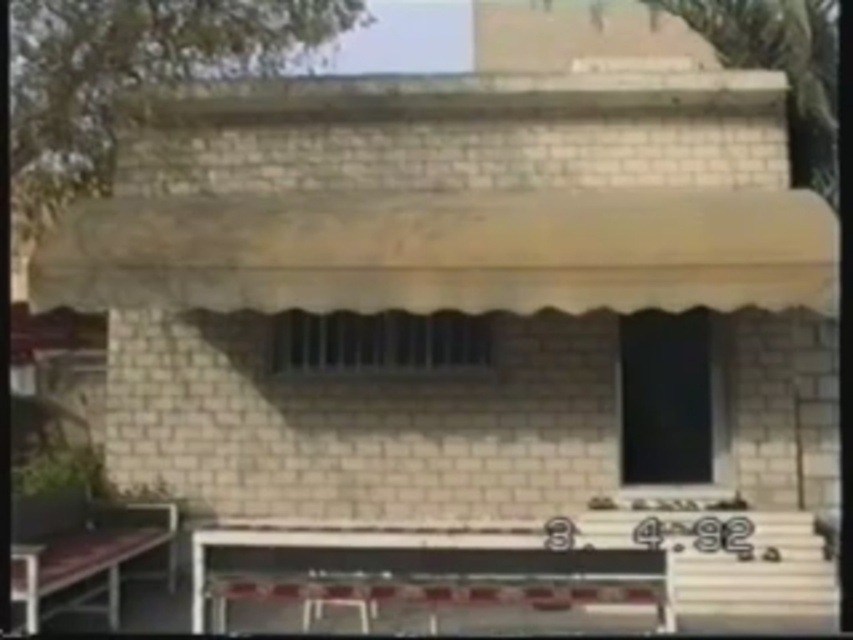
In the scene shown: Measure the distance between point [595,580] and camera.

Point [595,580] and camera are 22.18 feet apart from each other.

Is point (252, 554) positioned before point (83, 525)?

Yes, point (252, 554) is closer to viewer.

Who is more distant from viewer, (379, 577) or (38, 532)?

The point (38, 532) is more distant.

The width and height of the screenshot is (853, 640). What are the coordinates of `white plastic picnic table at lower center` in the screenshot? It's located at (428, 573).